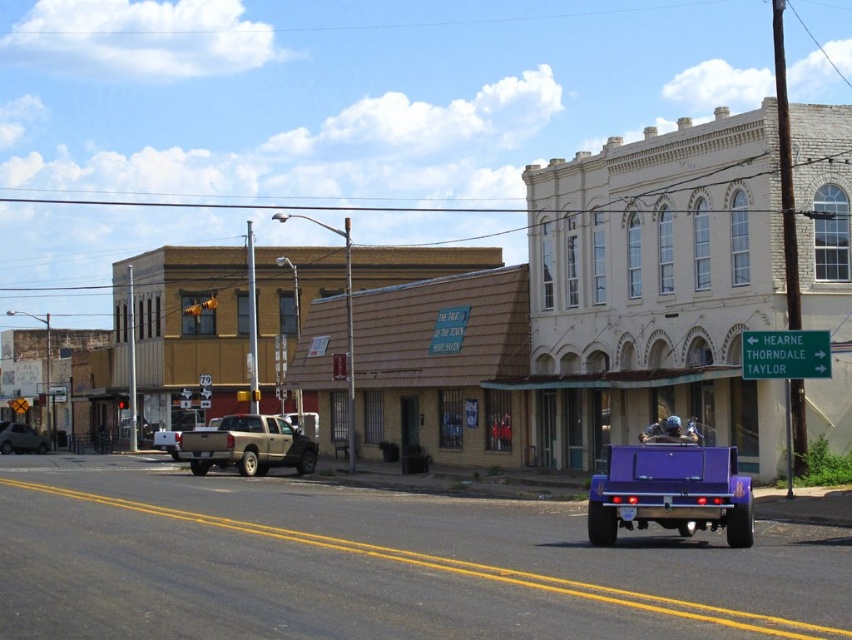
You are standing at the point with coordinates point (619, 515) and want to walk towards the point with coordinates point (763, 256). Which direction should you face to move towards it?

You should face north because point (763, 256) is behind point (619, 515), indicating it is in the northern direction.

You are a delivery driver who needs to park your truck in the center of the street. You have two trucks available, a purple glossy truck at center and a gold metallic truck at center. Based on the scene, which truck should you choose to park so that it is visible from the green directional sign pointing towards HEARNE, THORNDALE, and TAYLOR?

The purple glossy truck at center is above the gold metallic truck at center, so choosing the purple glossy truck at center would make it more visible from the green directional sign pointing towards HEARNE, THORNDALE, and TAYLOR since it is positioned higher.